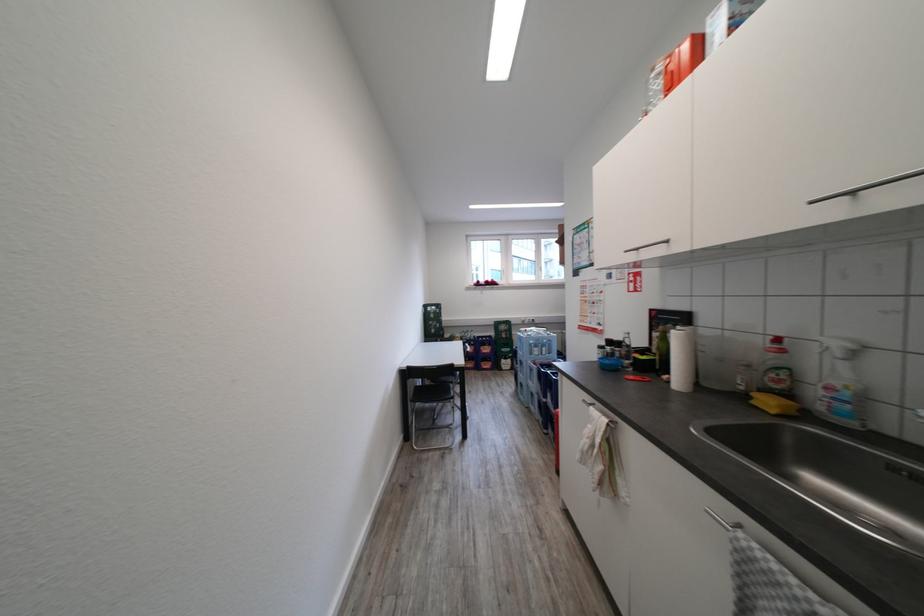
What do you see at coordinates (431, 392) in the screenshot? This screenshot has height=616, width=924. I see `a chair sitting surface` at bounding box center [431, 392].